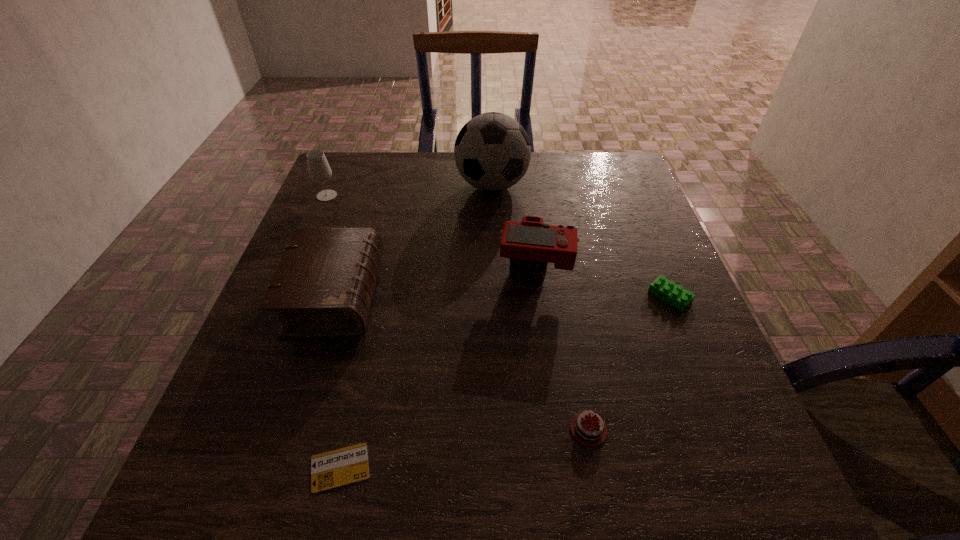
The image size is (960, 540). In order to click on vacant area that satisfies the following two spatial constraints: 1. on the front side of the camera; 2. on the right side of the rightmost object in this screenshot , I will do point(539,297).

At what (x,y) coordinates should I click in order to perform the action: click on vacant space that satisfies the following two spatial constraints: 1. on the front side of the chocolate cake; 2. on the right side of the camera. Please return your answer as a coordinate pair (x, y). This screenshot has width=960, height=540. Looking at the image, I should click on (556, 430).

Locate an element on the screen. The image size is (960, 540). vacant space that satisfies the following two spatial constraints: 1. on the main logo of the rightmost object; 2. on the left side of the soccer ball is located at coordinates (495, 297).

This screenshot has width=960, height=540. I want to click on vacant space that satisfies the following two spatial constraints: 1. on the back side of the identity card; 2. on the left side of the rightmost object, so click(378, 297).

The width and height of the screenshot is (960, 540). Find the location of `free point that satisfies the following two spatial constraints: 1. on the main logo of the tallest object; 2. on the spine side of the fourth tallest object`. free point that satisfies the following two spatial constraints: 1. on the main logo of the tallest object; 2. on the spine side of the fourth tallest object is located at coordinates point(495,296).

Identify the location of vacant space that satisfies the following two spatial constraints: 1. on the main logo of the tallest object; 2. on the right side of the chocolate cake. The width and height of the screenshot is (960, 540). (500, 430).

The width and height of the screenshot is (960, 540). I want to click on vacant space that satisfies the following two spatial constraints: 1. on the back side of the shortest object; 2. on the spine side of the fourth tallest object, so click(378, 296).

You are a GUI agent. You are given a task and a screenshot of the screen. Output one action in this format:
    pyautogui.click(x=<x>, y=<y>)
    Task: Click on the vacant space that satisfies the following two spatial constraints: 1. on the main logo of the soccer ball; 2. on the right side of the Lego
    Image resolution: width=960 pixels, height=540 pixels.
    Given the screenshot: What is the action you would take?
    pyautogui.click(x=495, y=297)

Identify the location of vacant region that satisfies the following two spatial constraints: 1. on the spine side of the identity card; 2. on the left side of the Bible. This screenshot has width=960, height=540. 280,468.